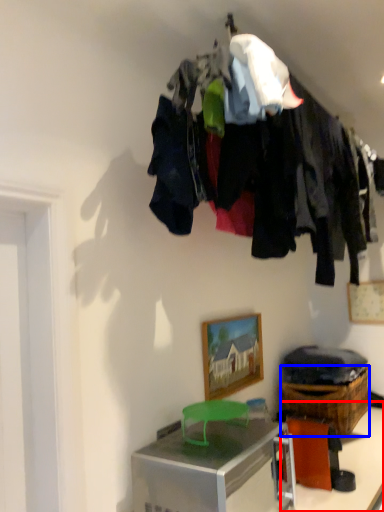
Question: Which object appears closest to the camera in this image, table (highlighted by a red box) or crate (highlighted by a blue box)?

Choices:
 (A) table
 (B) crate

Answer: (A)